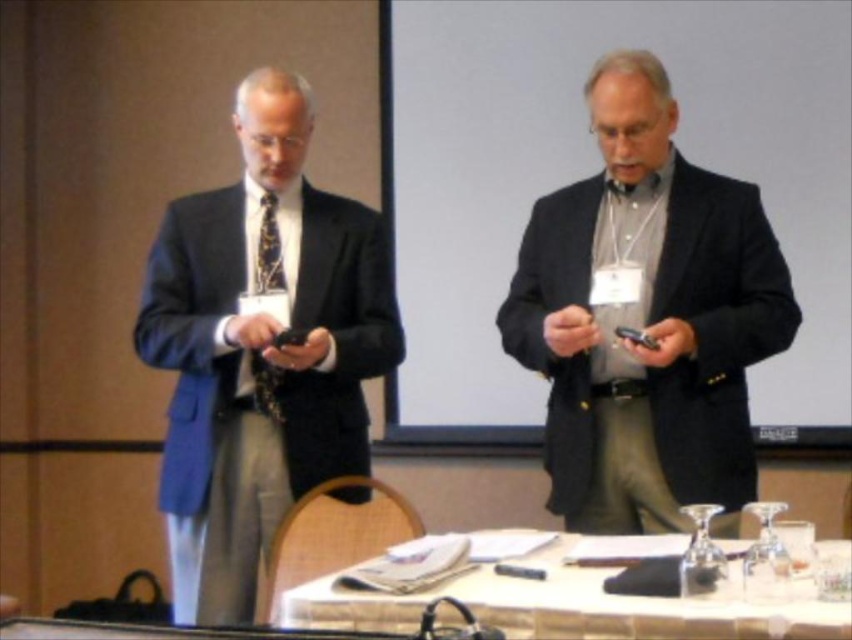
Measure the distance between matte black suit at left and white glossy table at lower center.

79.89 centimeters

Which is in front, point (302, 260) or point (315, 608)?

Point (315, 608) is in front.

Is point (160, 268) positioned before point (435, 588)?

That is False.

This screenshot has height=640, width=852. What are the coordinates of `matte black suit at left` in the screenshot? It's located at (262, 349).

Who is more distant from viewer, (711, 227) or (776, 627)?

Positioned behind is point (711, 227).

Who is more forward, (x=640, y=234) or (x=573, y=609)?

Positioned in front is point (x=573, y=609).

The width and height of the screenshot is (852, 640). What are the coordinates of `matte black suit at center` in the screenshot? It's located at (648, 320).

Between point (715, 449) and point (156, 349), which one is positioned in front?

Point (715, 449) is in front.

Is point (573, 513) less distant than point (324, 205)?

Yes, it is in front of point (324, 205).

This screenshot has height=640, width=852. In order to click on matte black suit at center in this screenshot , I will do `click(648, 320)`.

The image size is (852, 640). I want to click on matte black suit at center, so (x=648, y=320).